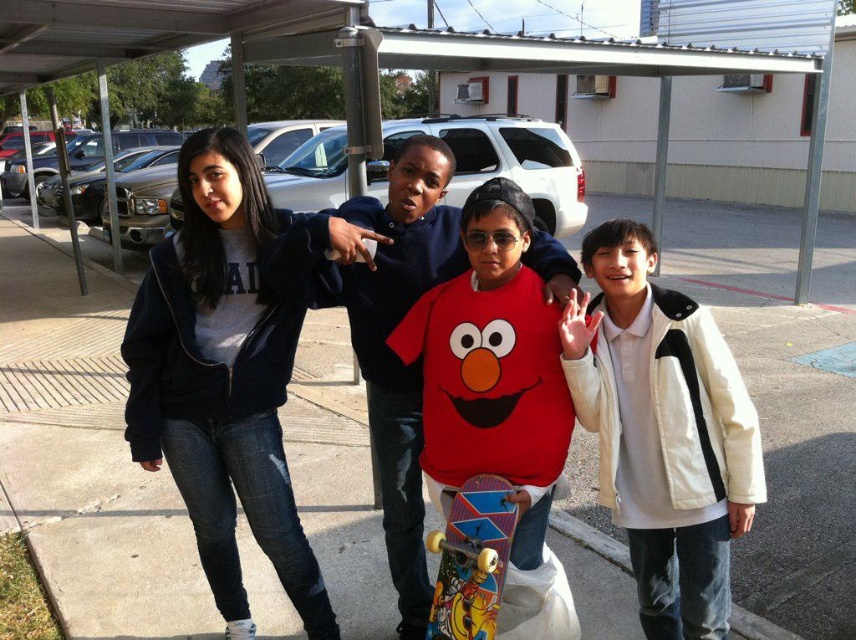
You are standing on the concrete at center and want to pick up the multicolored plastic skateboard at center. Is the skateboard below or above your current position?

The concrete at center is above the multicolored plastic skateboard at center, so the skateboard is below your current position.

You are standing in the parking lot and want to place a small potted plant between the concrete at center and the multicolored plastic skateboard at center. Which object should the plant be closer to if you want it to be closer to the viewer?

The plant should be placed closer to the concrete at center because it is already further to the viewer than the skateboard, so positioning the plant near the concrete would make it closer to the viewer.

You are a photographer trying to capture a clear photo of the multicolored plastic skateboard at center and the white cotton jacket at right. However, the skateboard is currently blocked by the jacket. Can you adjust your position to see both objects without obstruction?

The multicolored plastic skateboard at center is behind the white cotton jacket at right, so moving to the left side might allow you to see both objects without the jacket obstructing the skateboard.